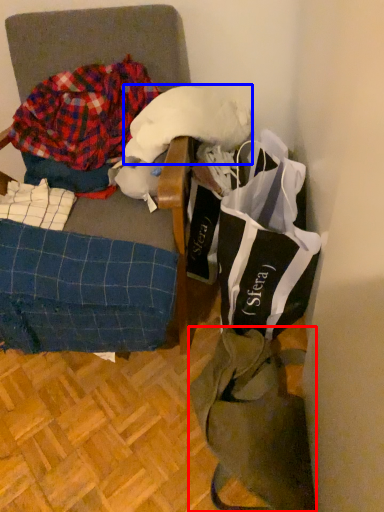
Question: Which object is closer to the camera taking this photo, tote bag (highlighted by a red box) or wool (highlighted by a blue box)?

Choices:
 (A) tote bag
 (B) wool

Answer: (A)